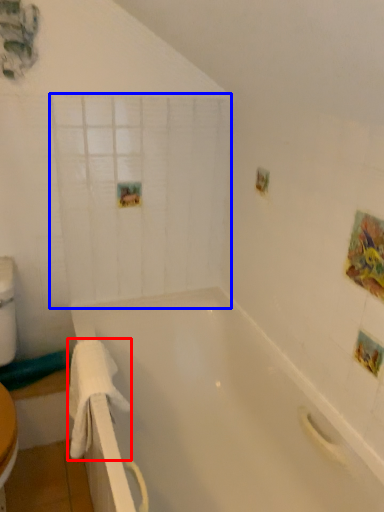
Question: Which of the following is the farthest to the observer, towel/napkin (highlighted by a red box) or glass door (highlighted by a blue box)?

Choices:
 (A) towel/napkin
 (B) glass door

Answer: (B)